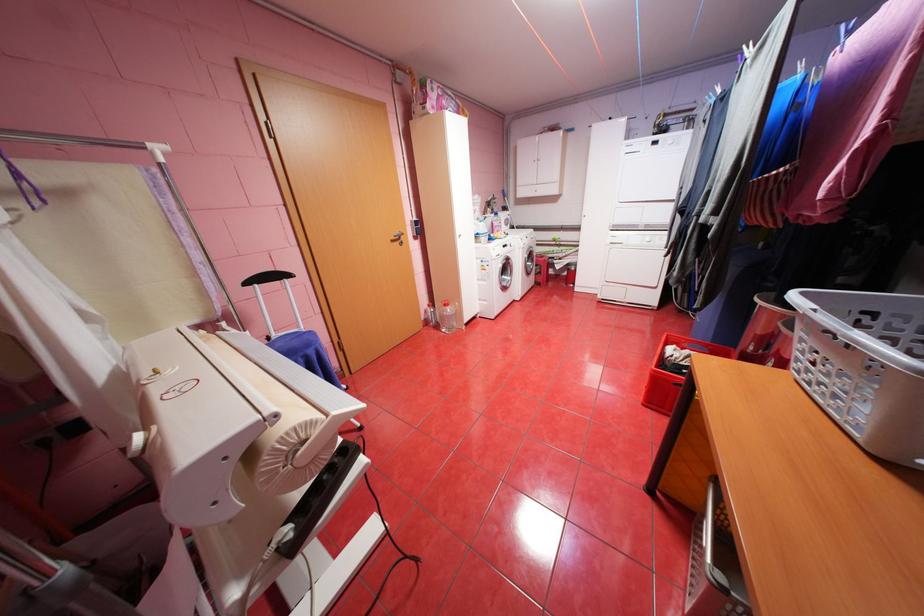
Locate an element on the screen. small cabinet knob is located at coordinates (397, 238).